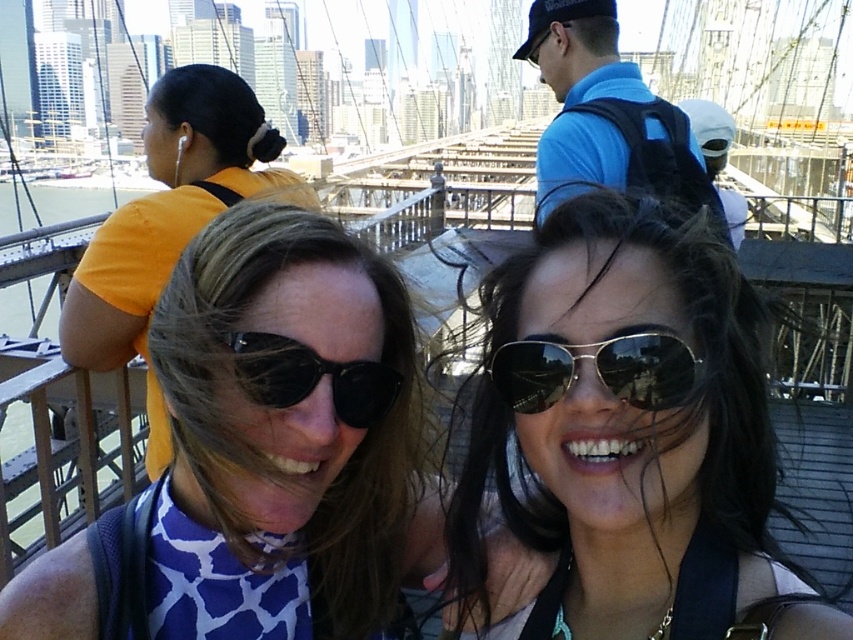
Can you confirm if blue printed shirt at center is wider than metallic reflective sunglasses at center?

Correct, the width of blue printed shirt at center exceeds that of metallic reflective sunglasses at center.

Which is behind, point (251, 364) or point (543, 342)?

The point (543, 342) is behind.

This screenshot has height=640, width=853. What do you see at coordinates (283, 429) in the screenshot?
I see `blue printed shirt at center` at bounding box center [283, 429].

Find the location of a particular element. The image size is (853, 640). blue printed shirt at center is located at coordinates click(283, 429).

This screenshot has width=853, height=640. What do you see at coordinates (619, 412) in the screenshot?
I see `shiny black sunglasses at center` at bounding box center [619, 412].

Is shiny black sunglasses at center bigger than matte black sunglasses at center?

No, shiny black sunglasses at center is not bigger than matte black sunglasses at center.

The height and width of the screenshot is (640, 853). I want to click on shiny black sunglasses at center, so click(619, 412).

Does point (679, 115) lie in front of point (317, 355)?

No, (679, 115) is further to viewer.

Does blue fabric backpack at upper center have a larger size compared to black reflective sunglasses at center?

Yes, blue fabric backpack at upper center is bigger than black reflective sunglasses at center.

Is point (700, 200) closer to viewer compared to point (363, 413)?

No, (700, 200) is behind (363, 413).

Locate an element on the screen. The height and width of the screenshot is (640, 853). blue fabric backpack at upper center is located at coordinates (607, 115).